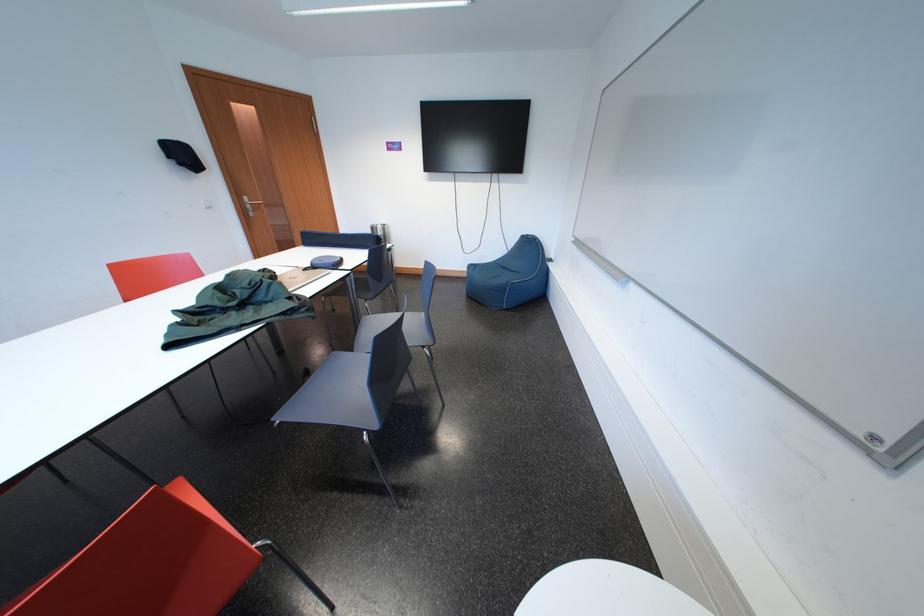
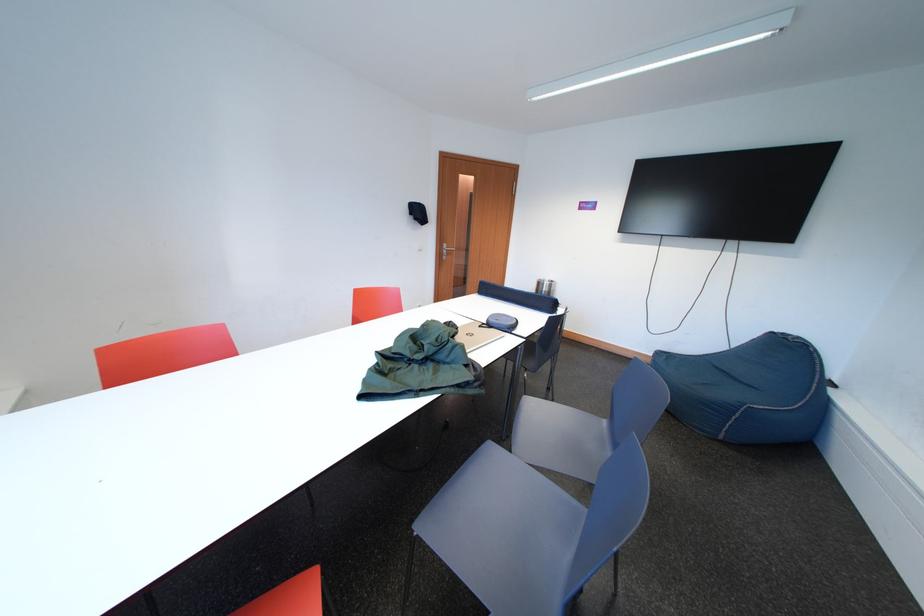
Question: The first image is from the beginning of the video and the second image is from the end. How did the camera likely rotate when shooting the video?

Choices:
 (A) Left
 (B) Right
 (C) Up
 (D) Down

Answer: (A)